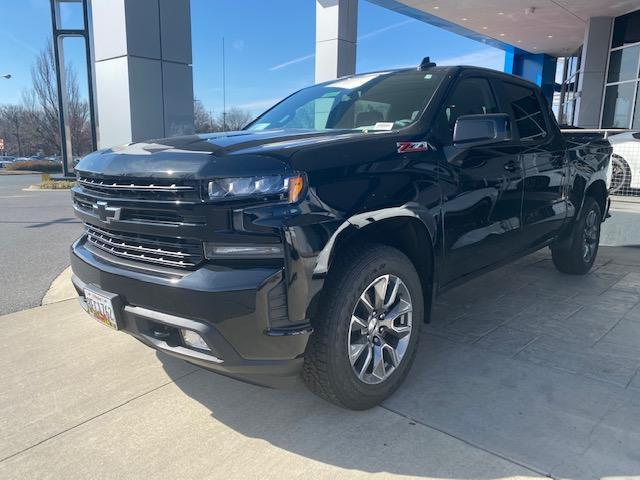
The height and width of the screenshot is (480, 640). Identify the location of column. (141, 66), (333, 23), (513, 63), (546, 81), (598, 85).